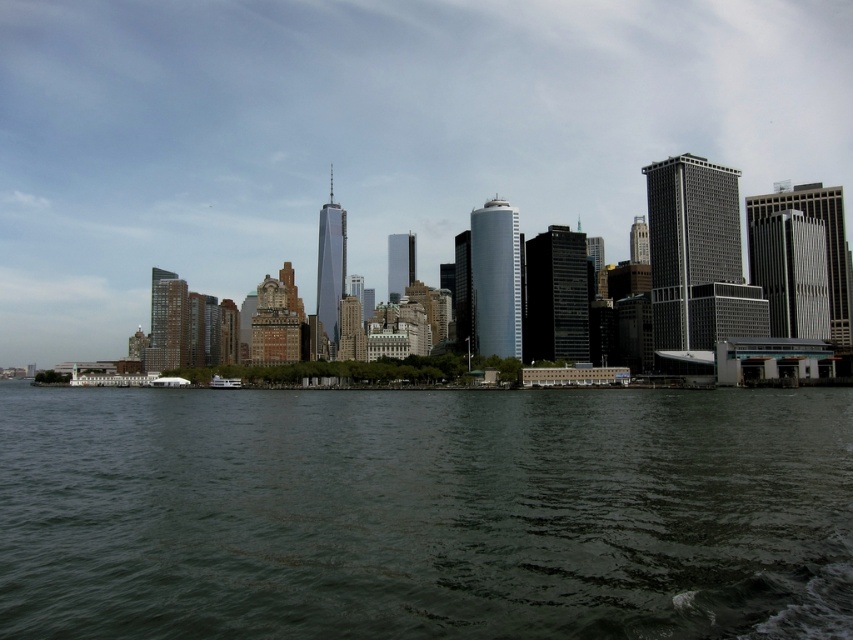
Between dark green water at center and white glossy boat at center, which one has less height?

white glossy boat at center is shorter.

Looking at this image, can you confirm if dark green water at center is positioned to the left of white glossy boat at center?

No, dark green water at center is not to the left of white glossy boat at center.

Does point (204, 588) come in front of point (233, 388)?

That is True.

The image size is (853, 640). I want to click on dark green water at center, so click(x=425, y=513).

Does transparent glass skyscraper at center come in front of dark green water at center?

No, transparent glass skyscraper at center is further to the viewer.

Can you confirm if transparent glass skyscraper at center is wider than dark green water at center?

Indeed, transparent glass skyscraper at center has a greater width compared to dark green water at center.

Who is more distant from viewer, (160, 67) or (86, 572)?

Point (160, 67)

The height and width of the screenshot is (640, 853). What are the coordinates of `transparent glass skyscraper at center` in the screenshot? It's located at (369, 134).

Where is `transparent glass skyscraper at center`? The height and width of the screenshot is (640, 853). transparent glass skyscraper at center is located at coordinates (369, 134).

Where is `transparent glass skyscraper at center`? The image size is (853, 640). transparent glass skyscraper at center is located at coordinates (369, 134).

Locate an element on the screen. This screenshot has height=640, width=853. transparent glass skyscraper at center is located at coordinates [369, 134].